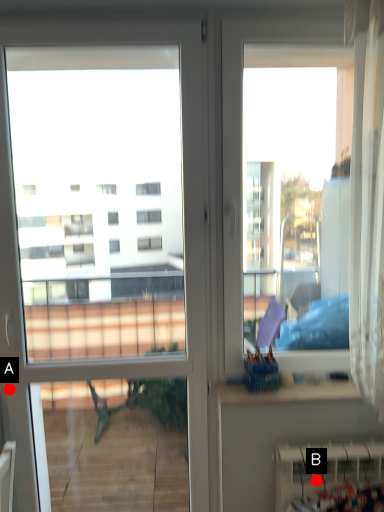
Question: Two points are circled on the image, labeled by A and B beside each circle. Which point is closer to the camera taking this photo?

Choices:
 (A) A is closer
 (B) B is closer

Answer: (B)